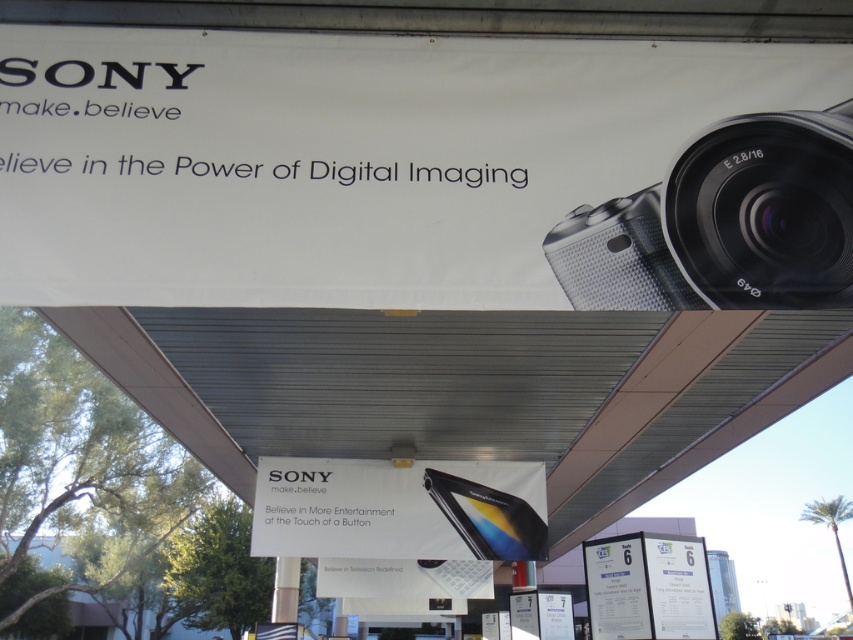
Question: Observing the image, what is the correct spatial positioning of silver textured camera at upper right in reference to black glossy smartphone at center?

Choices:
 (A) left
 (B) right

Answer: (B)

Question: Is silver textured camera at upper right below black glossy smartphone at center?

Choices:
 (A) yes
 (B) no

Answer: (B)

Question: Which object is the closest to the silver textured camera at upper right?

Choices:
 (A) black glossy smartphone at center
 (B) white paper at lower right

Answer: (B)

Question: Considering the real-world distances, which object is closest to the white paper at lower right?

Choices:
 (A) black glossy smartphone at center
 (B) silver textured camera at upper right

Answer: (A)

Question: Which point appears farthest from the camera in this image?

Choices:
 (A) [x=483, y=476]
 (B) [x=618, y=248]
 (C) [x=631, y=588]

Answer: (A)

Question: Can you confirm if silver textured camera at upper right is positioned below black glossy smartphone at center?

Choices:
 (A) no
 (B) yes

Answer: (A)